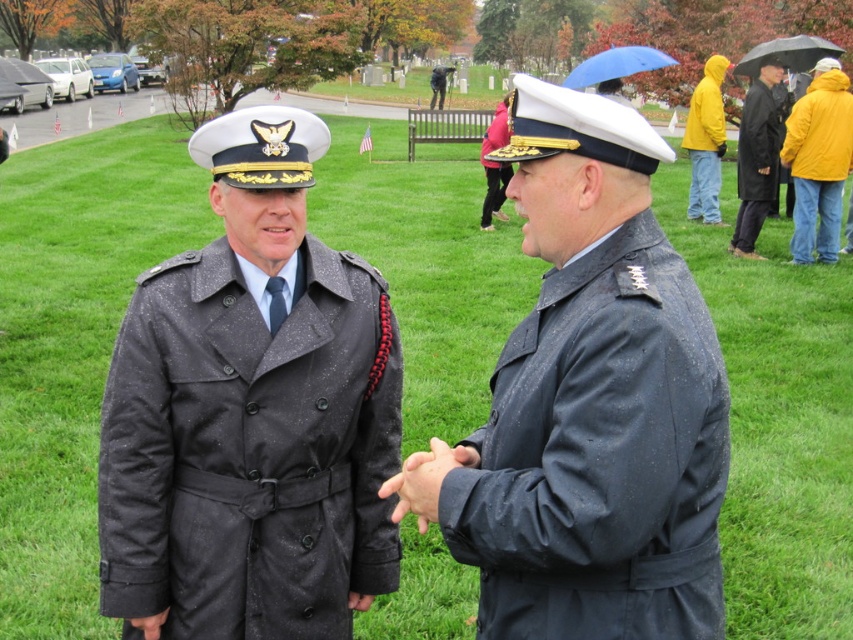
Does point (573, 442) lie behind point (827, 132)?

No, it is in front of (827, 132).

Who is more distant from viewer, (671,518) or (788,125)?

The point (788,125) is more distant.

This screenshot has height=640, width=853. Find the location of `matte black uniform at center`. matte black uniform at center is located at coordinates (589, 404).

Can you confirm if yellow matte jacket at right is thinner than black leather coat at right?

Yes, yellow matte jacket at right is thinner than black leather coat at right.

Can you confirm if yellow matte jacket at right is positioned to the right of black leather coat at right?

Indeed, yellow matte jacket at right is positioned on the right side of black leather coat at right.

You are a GUI agent. You are given a task and a screenshot of the screen. Output one action in this format:
    pyautogui.click(x=<x>, y=<y>)
    Task: Click on the yellow matte jacket at right
    The image size is (853, 640).
    Given the screenshot: What is the action you would take?
    pyautogui.click(x=817, y=161)

Who is positioned more to the right, matte black trench coat at center or matte black uniform at center?

matte black uniform at center is more to the right.

Who is more distant from viewer, (190, 456) or (596, 186)?

The point (190, 456) is behind.

Is point (241, 616) positioned behind point (535, 416)?

That is True.

Locate an element on the screen. The image size is (853, 640). matte black trench coat at center is located at coordinates (251, 413).